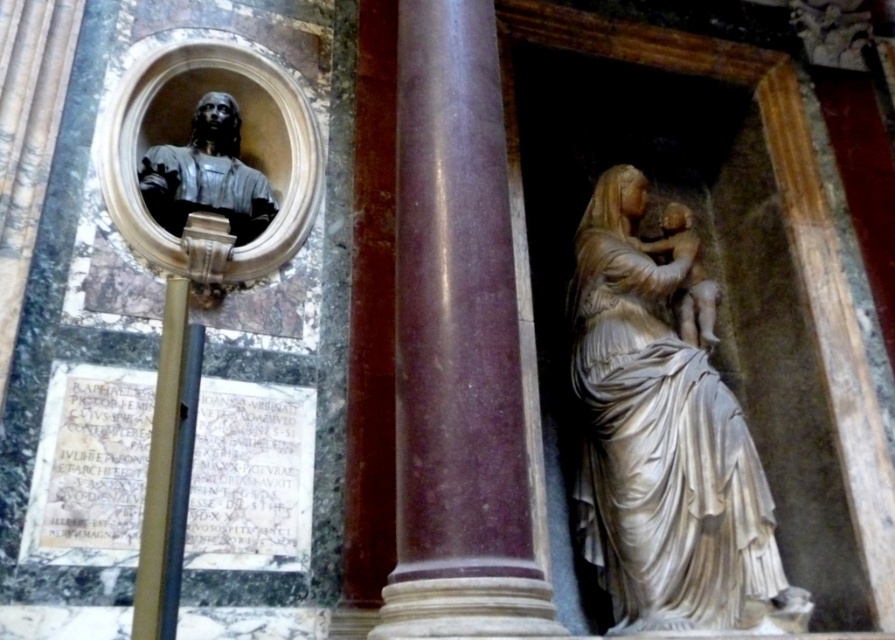
You are an art conservator examining the monument. You need to clean the white marble statue at center and the white marble statue at right. Which statue should you clean first if you want to start with the one closer to the viewer?

The white marble statue at center is in front of the white marble statue at right, so you should clean the white marble statue at center first as it is closer to the viewer.

You are an art conservator examining the monument. You notice a point marked at coordinates (207, 173). What object does this point correspond to?

The point at coordinates (207, 173) corresponds to the polished bronze bust at upper left.

Consider the image. You are an art conservator assessing the spatial arrangement of statues in a cathedral. You need to ensure that the white marble statue at center and the white marble statue at right are positioned according to historical records. According to the records, the statue at the center should be taller than the one on the right. Does the current arrangement align with this requirement?

Yes, the current arrangement aligns with the historical records because the white marble statue at center is taller than the white marble statue at right as specified.